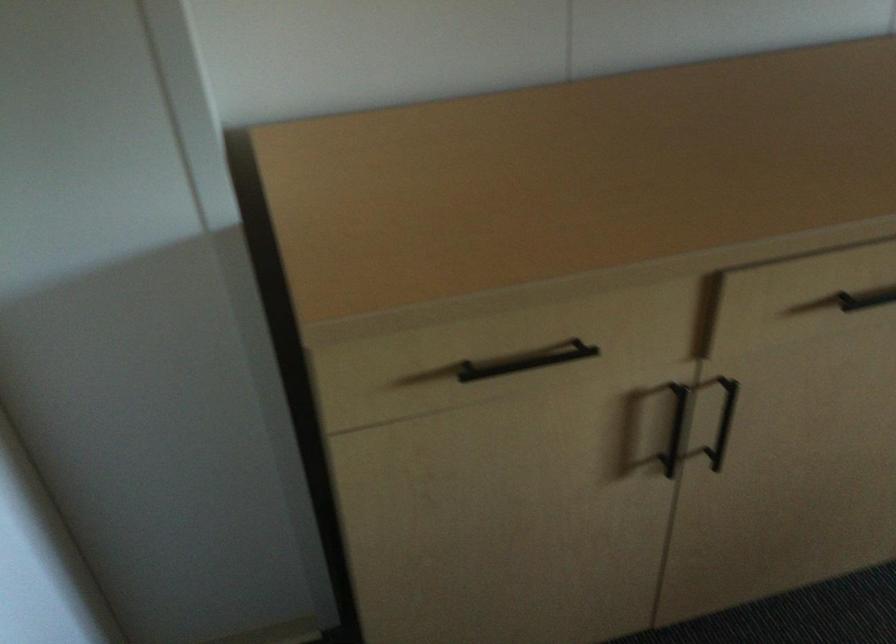
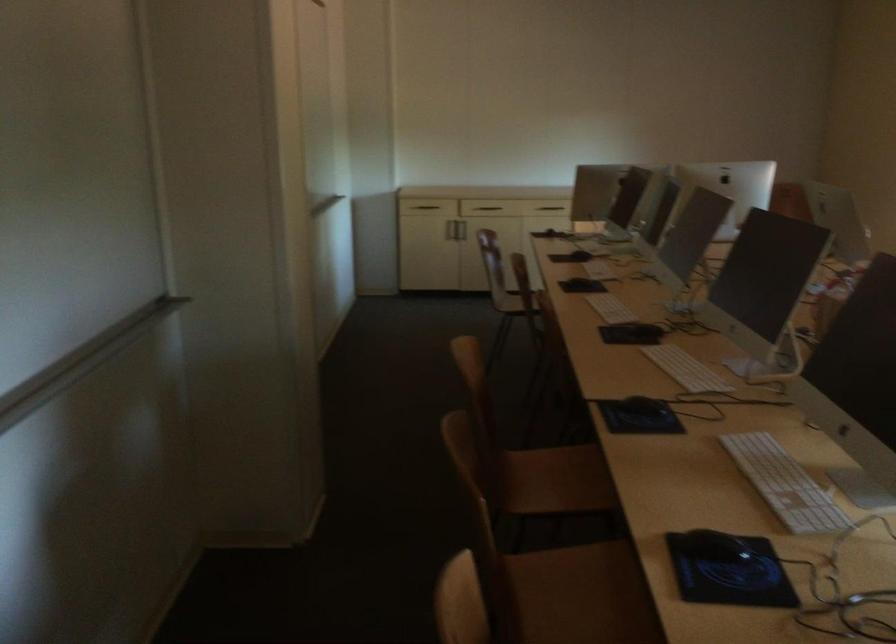
Question: I am providing you with two images of the same scene from different viewpoints. After the viewpoint changes to image2, which objects are now occluded?

Choices:
 (A) yellow floor pillow
 (B) wall-mounted handrail
 (C) wooden chair sitting surface
 (D) black cabinet handle

Answer: (D)